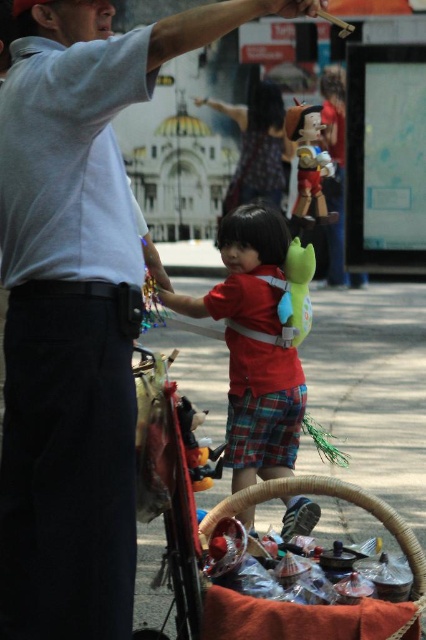
Which is more to the left, matte red shirt at center or woven brown basket at lower center?

matte red shirt at center is more to the left.

Who is more distant from viewer, (265, 349) or (419, 561)?

The point (265, 349) is more distant.

Which is behind, point (258, 442) or point (422, 556)?

The point (258, 442) is more distant.

Identify the location of matte red shirt at center. The width and height of the screenshot is (426, 640). 253,346.

Does woven brown basket at lower center appear on the left side of shiny red plastic toy at center?

Yes, woven brown basket at lower center is to the left of shiny red plastic toy at center.

Image resolution: width=426 pixels, height=640 pixels. Describe the element at coordinates (336, 497) in the screenshot. I see `woven brown basket at lower center` at that location.

Where is `woven brown basket at lower center`? The width and height of the screenshot is (426, 640). woven brown basket at lower center is located at coordinates coord(336,497).

Is matte red shirt at center taller than shiny red plastic toy at center?

Yes.

Is matte red shirt at center wider than shiny red plastic toy at center?

Yes.

This screenshot has height=640, width=426. What do you see at coordinates (253, 346) in the screenshot?
I see `matte red shirt at center` at bounding box center [253, 346].

Find the location of a particular element. matte red shirt at center is located at coordinates (253, 346).